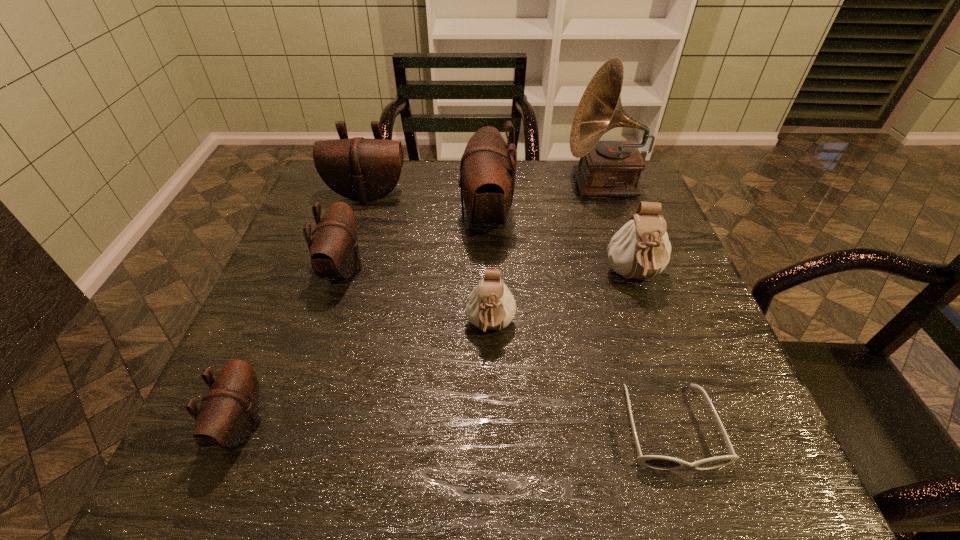
You are a GUI agent. You are given a task and a screenshot of the screen. Output one action in this format:
    pyautogui.click(x=<x>, y=<y>)
    Task: Click on the vacant position located 0.260m with the flap open on the second biggest brown pouch
    
    Given the screenshot: What is the action you would take?
    pyautogui.click(x=343, y=275)

I want to click on vacant space located 0.300m on the front-facing side of the rightmost pouch, so click(689, 437).

The width and height of the screenshot is (960, 540). I want to click on vacant space located 0.130m with the flap open on the second smallest brown pouch, so click(419, 269).

Locate an element on the screen. Image resolution: width=960 pixels, height=540 pixels. vacant space located 0.050m on the front-facing side of the fifth farthest pouch is located at coordinates (492, 374).

This screenshot has height=540, width=960. Find the location of `vacant point located with the flap open on the nearest pouch`. vacant point located with the flap open on the nearest pouch is located at coordinates (482, 423).

Where is `phonograph record at the far edge`? This screenshot has height=540, width=960. phonograph record at the far edge is located at coordinates (606, 168).

Where is `pouch present at the near edge`? pouch present at the near edge is located at coordinates (229, 409).

Find the location of a particular element. The image size is (960, 540). sunglasses that is positioned at the near edge is located at coordinates (657, 462).

This screenshot has height=540, width=960. I want to click on phonograph record that is at the right edge, so click(606, 168).

This screenshot has height=540, width=960. Find the location of `pouch situated at the right edge`. pouch situated at the right edge is located at coordinates (641, 248).